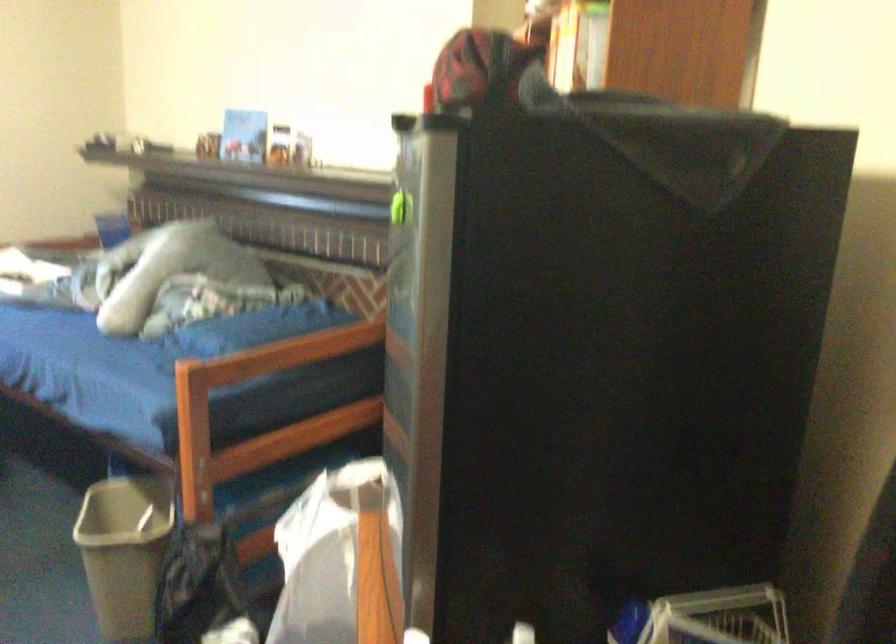
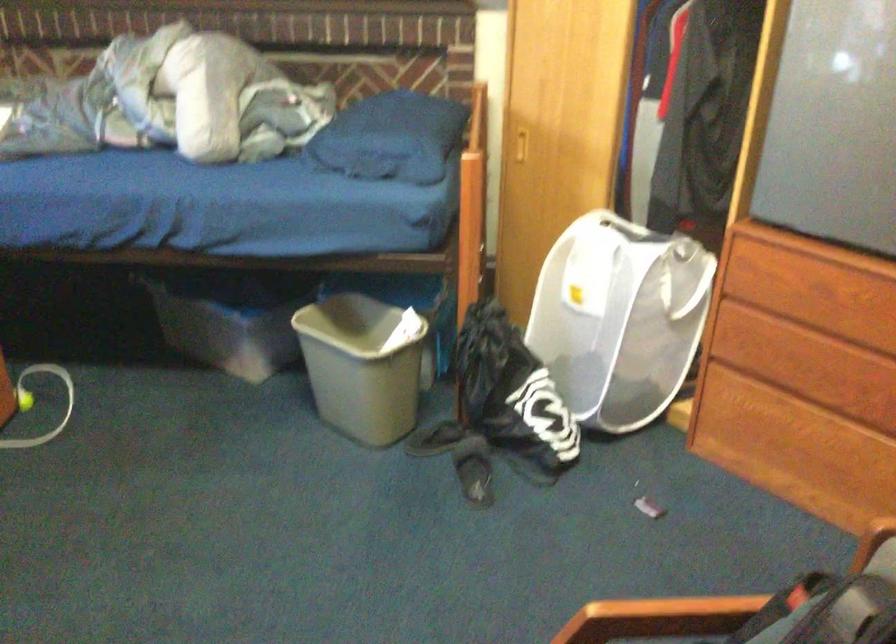
Question: I am providing you with two images of the same scene from different viewpoints. After the viewpoint changes to image2, which objects are now occluded?

Choices:
 (A) black flip-flop
 (B) trash can handle
 (C) wooden chair armrest
 (D) none of these

Answer: (D)